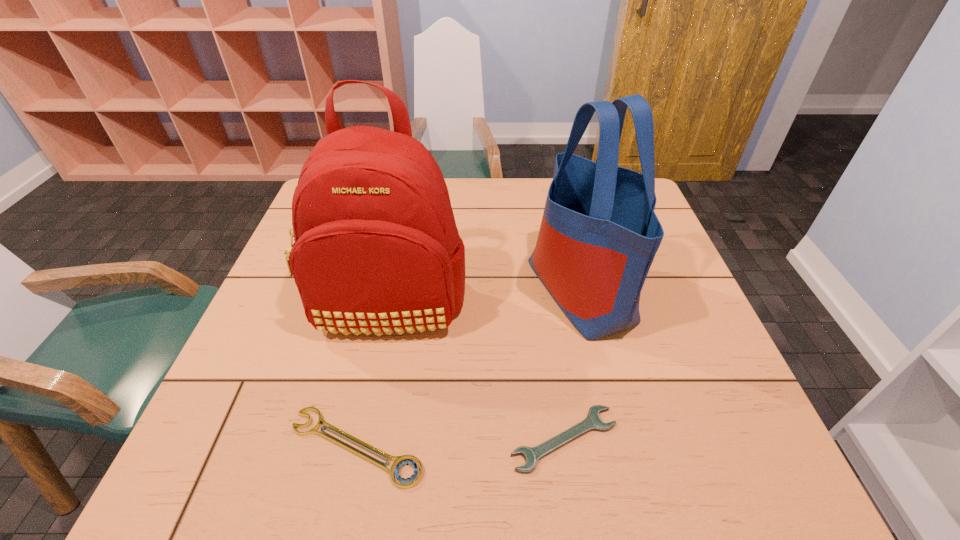
The height and width of the screenshot is (540, 960). I want to click on backpack, so click(x=377, y=249).

Locate an element on the screen. handbag is located at coordinates (599, 234).

Identify the location of the right wrench. The image size is (960, 540). (592, 422).

This screenshot has width=960, height=540. Identify the location of the left wrench. (407, 460).

Locate an element on the screen. The image size is (960, 540). vacant region located on the front-facing side of the backpack is located at coordinates (354, 469).

Locate an element on the screen. Image resolution: width=960 pixels, height=540 pixels. vacant area situated on the left of the handbag is located at coordinates (381, 290).

Locate an element on the screen. This screenshot has height=540, width=960. free space located 0.340m on the left of the right wrench is located at coordinates (324, 439).

You are a GUI agent. You are given a task and a screenshot of the screen. Output one action in this format:
    pyautogui.click(x=<x>, y=<y>)
    Task: Click on the vacant space located on the left of the left wrench
    The image size is (960, 540).
    Given the screenshot: What is the action you would take?
    pyautogui.click(x=199, y=447)

This screenshot has width=960, height=540. In order to click on object that is positioned at the left edge in this screenshot , I will do `click(377, 249)`.

The width and height of the screenshot is (960, 540). Identify the location of object located in the right edge section of the desktop. (599, 234).